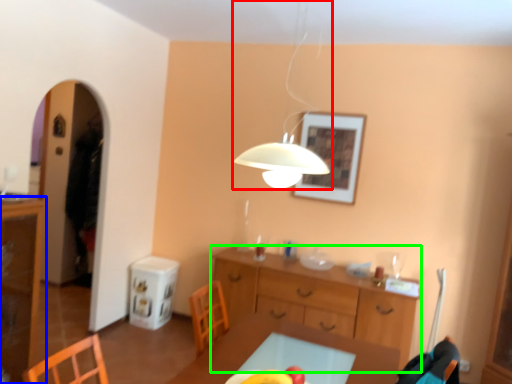
Question: Estimate the real-world distances between objects in this image. Which object is closer to lamp (highlighted by a red box), cabinetry (highlighted by a blue box) or desk (highlighted by a green box)?

Choices:
 (A) cabinetry
 (B) desk

Answer: (B)